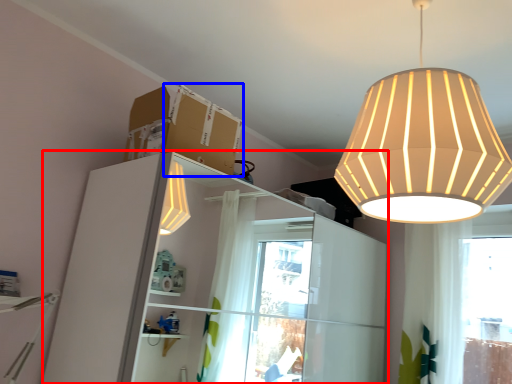
Question: Among these objects, which one is farthest to the camera, dresser (highlighted by a red box) or cardboard box (highlighted by a blue box)?

Choices:
 (A) dresser
 (B) cardboard box

Answer: (B)